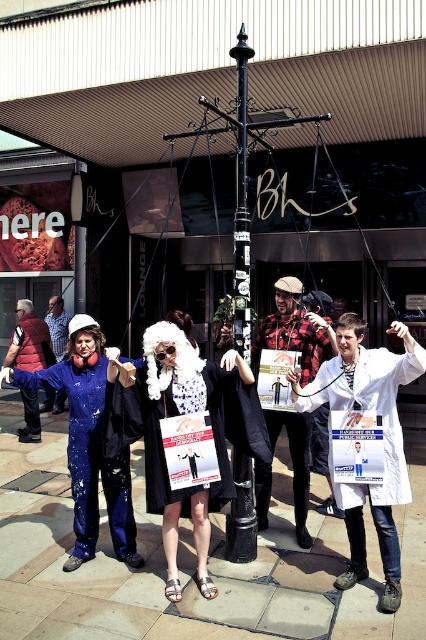
Question: Which point is closer to the camera?

Choices:
 (A) click(288, 308)
 (B) click(221, 452)

Answer: (B)

Question: Which point appears farthest from the camera in this image?

Choices:
 (A) (241, 531)
 (B) (400, 380)
 (C) (137, 396)

Answer: (A)

Question: Is white fluffy wig at center to the left of white lab coat at center from the viewer's perspective?

Choices:
 (A) no
 (B) yes

Answer: (B)

Question: Where is black velvet cape at center located in relation to matte blue jumpsuit at left in the image?

Choices:
 (A) above
 (B) below

Answer: (B)

Question: Which of the following is the closest to the observer?

Choices:
 (A) flannel plaid shirt at center
 (B) white lab coat at center

Answer: (B)

Question: Does black velvet cape at center lie in front of matte blue jumpsuit at left?

Choices:
 (A) yes
 (B) no

Answer: (A)